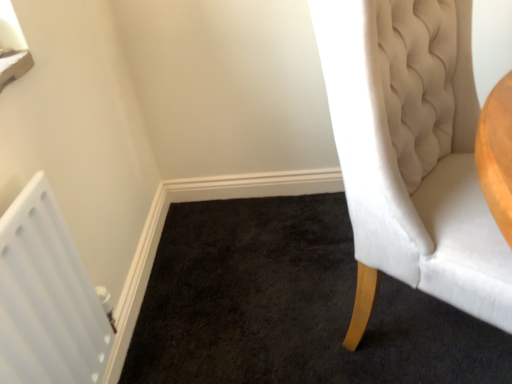
Question: Can you confirm if white velvet chair at right is positioned to the left of white plastic radiator at lower left?

Choices:
 (A) no
 (B) yes

Answer: (A)

Question: Is the depth of white velvet chair at right less than that of white plastic radiator at lower left?

Choices:
 (A) no
 (B) yes

Answer: (B)

Question: Can you see white velvet chair at right touching white plastic radiator at lower left?

Choices:
 (A) yes
 (B) no

Answer: (B)

Question: Is white velvet chair at right turned away from white plastic radiator at lower left?

Choices:
 (A) no
 (B) yes

Answer: (A)

Question: Is white plastic radiator at lower left located within white velvet chair at right?

Choices:
 (A) no
 (B) yes

Answer: (A)

Question: Is white velvet chair at right not within white plastic radiator at lower left?

Choices:
 (A) no
 (B) yes

Answer: (B)

Question: Is white plastic radiator at lower left taller than white velvet chair at right?

Choices:
 (A) yes
 (B) no

Answer: (B)

Question: Is white velvet chair at right a part of white plastic radiator at lower left?

Choices:
 (A) no
 (B) yes

Answer: (A)

Question: From the image's perspective, does white plastic radiator at lower left appear higher than white velvet chair at right?

Choices:
 (A) yes
 (B) no

Answer: (B)

Question: From the image's perspective, is white plastic radiator at lower left located beneath white velvet chair at right?

Choices:
 (A) yes
 (B) no

Answer: (A)

Question: Is the position of white plastic radiator at lower left less distant than that of white velvet chair at right?

Choices:
 (A) yes
 (B) no

Answer: (B)

Question: Can you confirm if white plastic radiator at lower left is thinner than white velvet chair at right?

Choices:
 (A) yes
 (B) no

Answer: (A)

Question: In terms of height, does white plastic radiator at lower left look taller or shorter compared to white velvet chair at right?

Choices:
 (A) short
 (B) tall

Answer: (A)